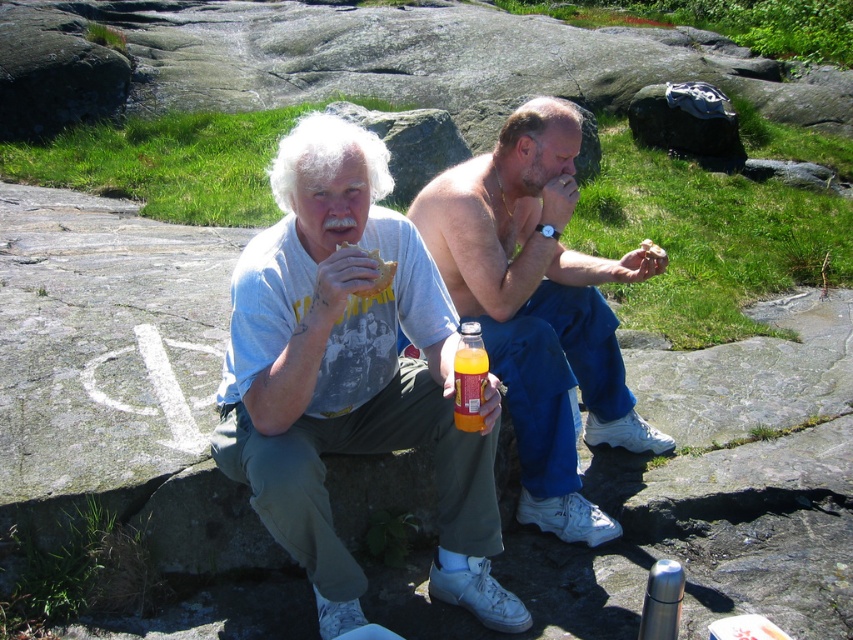
You are planning to take a photo of the shiny orange bottle at center and the matte bread at center. Which object should you focus on first if you want to capture both in the same frame without moving the camera?

The shiny orange bottle at center is taller than the matte bread at center, so you should focus on the shiny orange bottle at center first to ensure it fits within the frame.